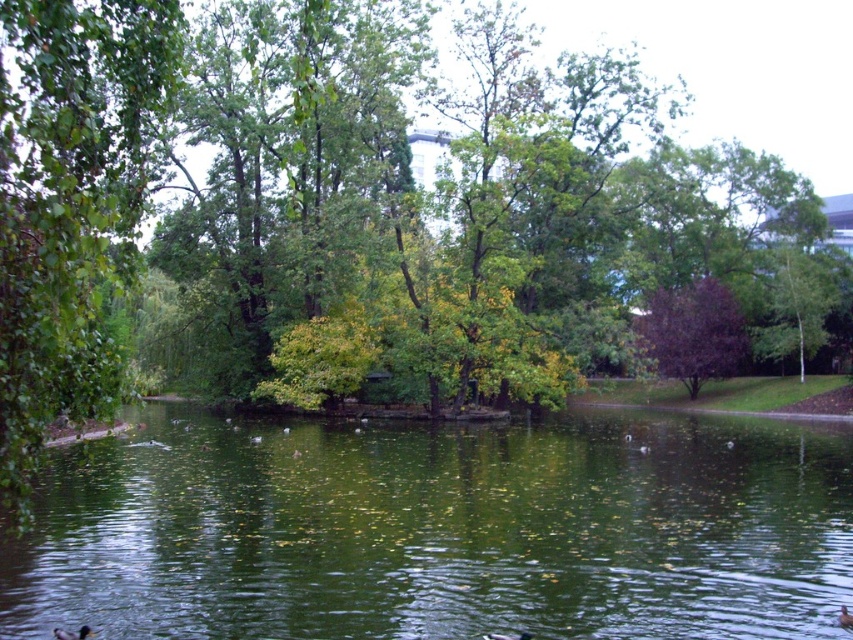
You are a photographer planning to capture the brown matte duck at lower center and the green reflective water at center in a single shot. Based on their positions, which object will appear larger in the photo?

The green reflective water at center will appear larger in the photo because it is much taller than the brown matte duck at lower center.

Based on the photo, you are a park visitor who wants to feed the brown matte duck at lower center with a bag of bread. You are currently standing on the green reflective water at center. Can you safely walk towards the duck without getting your feet wet?

The green reflective water at center and brown matte duck at lower center are 46.37 feet apart from each other. Since you are standing on the green reflective water at center, you would need to walk across the water to reach the duck, which is not possible without getting wet. Therefore, you cannot safely walk towards the duck without getting your feet wet.

You are standing at the edge of the water in the park scene and see the brown fuzzy duck at center. If you want to throw a pebble to hit the duck, where should you aim relative to the duck?

The brown fuzzy duck at center is at point (x=508, y=636) in 2D location, so you should aim slightly to the right of the duck since the reflection might cause the pebble to land off target.